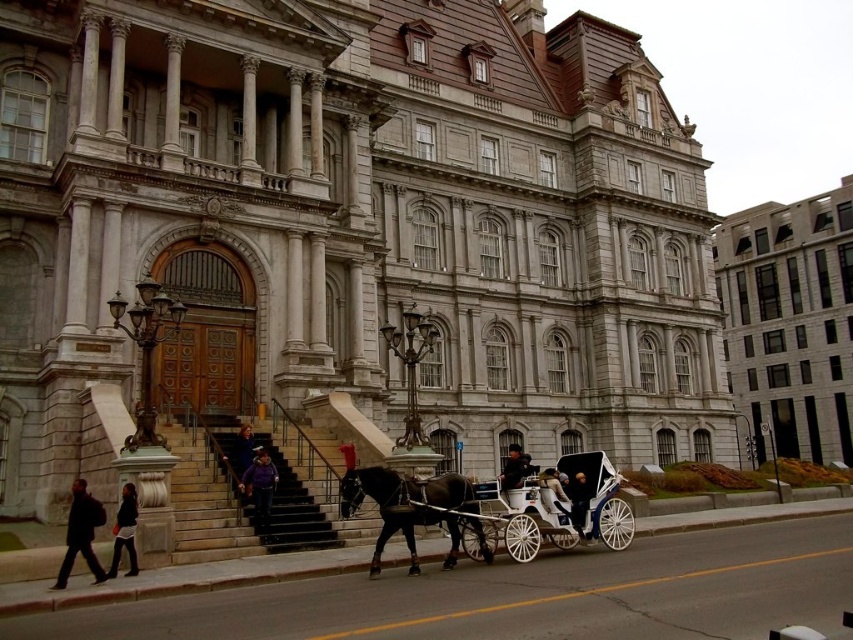
The image size is (853, 640). What do you see at coordinates (125, 531) in the screenshot? I see `dark gray jacket at lower left` at bounding box center [125, 531].

Which is in front, point (125, 516) or point (549, 468)?

Point (125, 516) is more forward.

Between point (125, 513) and point (561, 496), which one is positioned in front?

Point (125, 513) is in front.

The width and height of the screenshot is (853, 640). What are the coordinates of `dark gray jacket at lower left` in the screenshot? It's located at (125, 531).

This screenshot has width=853, height=640. Describe the element at coordinates (352, 225) in the screenshot. I see `stone building at center` at that location.

Does stone building at center have a larger size compared to black glossy horse at lower center?

Indeed, stone building at center has a larger size compared to black glossy horse at lower center.

The height and width of the screenshot is (640, 853). I want to click on stone building at center, so click(352, 225).

Is black glossy horse at lower center shorter than dark gray jacket at lower left?

Incorrect, black glossy horse at lower center's height does not fall short of dark gray jacket at lower left's.

Is the position of black glossy horse at lower center less distant than that of dark gray jacket at lower left?

That is False.

Image resolution: width=853 pixels, height=640 pixels. Identify the location of black glossy horse at lower center. (413, 509).